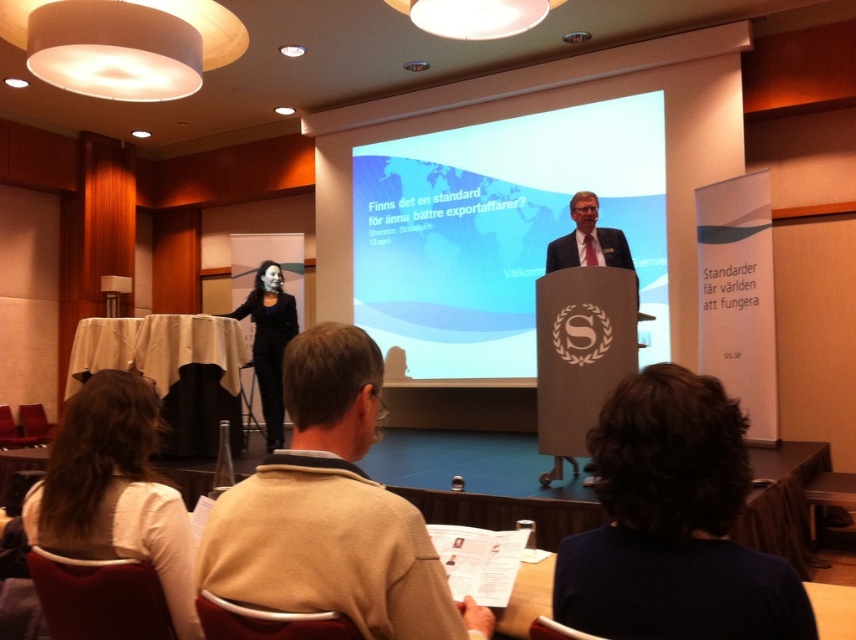
Question: Which point is farther from the camera taking this photo?

Choices:
 (A) 580,228
 (B) 732,461

Answer: (A)

Question: Which of these objects is positioned closest to the light brown wood podium at center?

Choices:
 (A) beige sweater at center
 (B) white fabric shirt at lower left
 (C) dark blue sweater at lower right

Answer: (B)

Question: Which point is closer to the camera taking this photo?

Choices:
 (A) 541,273
 (B) 324,522
 (C) 581,230
 (D) 629,552

Answer: (D)

Question: Does matte blue projector screen at center appear on the left side of beige sweater at center?

Choices:
 (A) yes
 (B) no

Answer: (B)

Question: Is beige sweater at center behind black fabric dress at center?

Choices:
 (A) yes
 (B) no

Answer: (B)

Question: Observing the image, what is the correct spatial positioning of dark blue sweater at lower right in reference to light brown wood podium at center?

Choices:
 (A) left
 (B) right

Answer: (A)